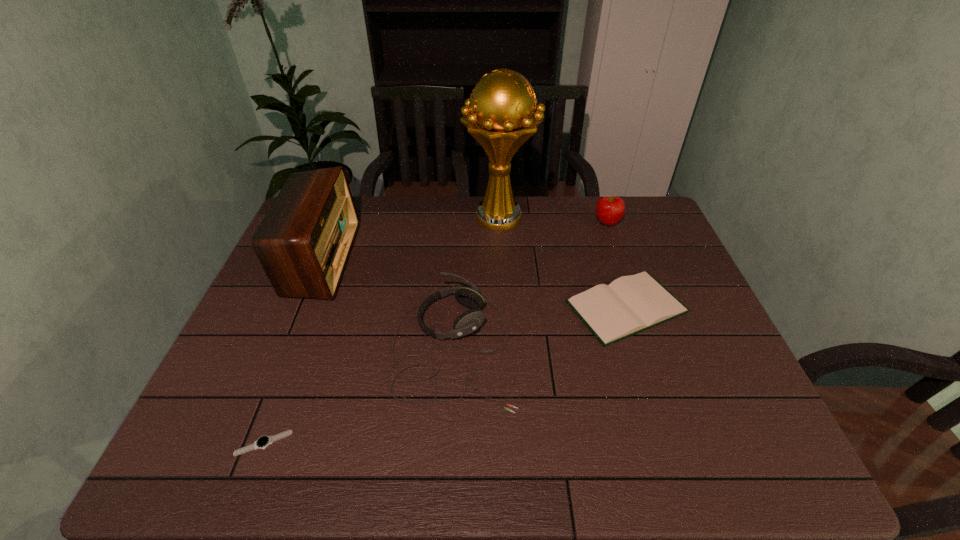
Find the location of a particular element. This screenshot has width=960, height=540. vacant area that lies between the headset and the apple is located at coordinates (530, 285).

Find the location of a particular element. The image size is (960, 540). free space between the fifth shortest object and the headset is located at coordinates (387, 303).

You are a GUI agent. You are given a task and a screenshot of the screen. Output one action in this format:
    pyautogui.click(x=<x>, y=<y>)
    Task: Click on the free space between the trophy_cup and the headset
    The image size is (960, 540).
    Given the screenshot: What is the action you would take?
    pyautogui.click(x=476, y=282)

What are the coordinates of `vacant area that lies between the headset and the trophy_cup` in the screenshot? It's located at (476, 282).

Find the location of `free space between the trophy_cup and the second shortest object`. free space between the trophy_cup and the second shortest object is located at coordinates (563, 262).

The image size is (960, 540). What are the coordinates of `free space between the fifth tallest object and the fifth shortest object` in the screenshot? It's located at (474, 283).

At what (x,y) coordinates should I click in order to perform the action: click on empty location between the headset and the trophy_cup. Please return your answer as a coordinate pair (x, y). Looking at the image, I should click on (476, 282).

Find the location of a particular element. Image resolution: width=960 pixels, height=540 pixels. free spot between the tallest object and the apple is located at coordinates (553, 220).

Find the location of a particular element. This screenshot has width=960, height=540. object that is the closest to the hardback book is located at coordinates (468, 322).

Locate which object ranks third in proximity to the watch. Please provide its 2D coordinates. Your answer should be formatted as a tuple, i.e. [(x, y)], where the tuple contains the x and y coordinates of a point satisfying the conditions above.

[(631, 304)]